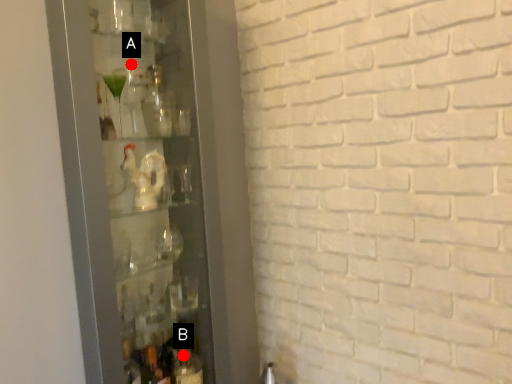
Question: Two points are circled on the image, labeled by A and B beside each circle. Which point appears farthest from the camera in this image?

Choices:
 (A) A is further
 (B) B is further

Answer: (B)